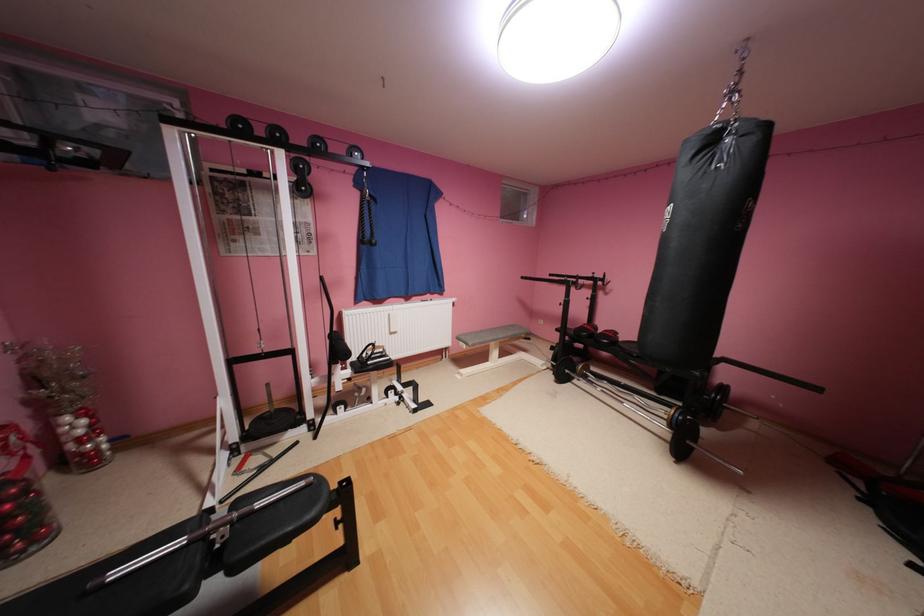
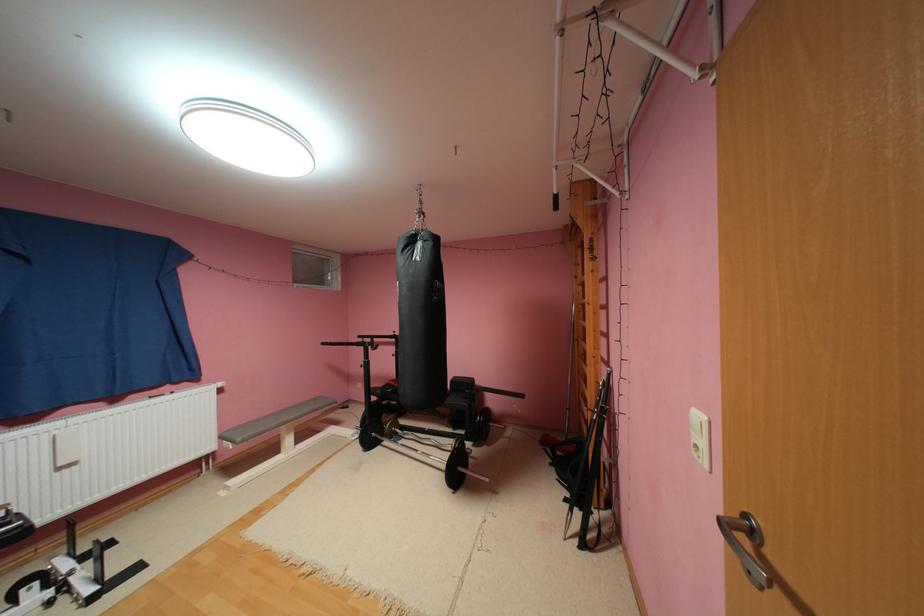
The point at (x=508, y=336) is marked in the first image. Where is the corresponding point in the second image?

(300, 416)